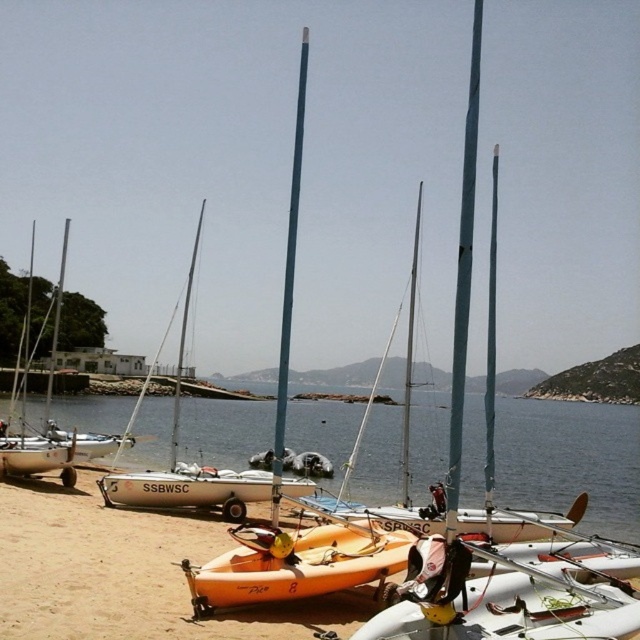
Question: Which point is closer to the camera taking this photo?

Choices:
 (A) (272, 509)
 (B) (248, 576)
 (C) (477, 493)
 (D) (120, 497)

Answer: (B)

Question: Is blue matte mast at center positioned behind white matte mast at left?

Choices:
 (A) no
 (B) yes

Answer: (A)

Question: From the image, what is the correct spatial relationship of clear blue water at center in relation to white matte sailboat at center?

Choices:
 (A) right
 (B) left

Answer: (A)

Question: Which of the following is the farthest from the observer?

Choices:
 (A) (291, 440)
 (B) (289, 292)
 (C) (202, 580)

Answer: (A)

Question: Considering the relative positions of clear blue water at center and white matte boat at center in the image provided, where is clear blue water at center located with respect to white matte boat at center?

Choices:
 (A) left
 (B) right

Answer: (B)

Question: Which object is the farthest from the white matte sailboat at center?

Choices:
 (A) blue matte mast at center
 (B) clear blue water at center
 (C) white matte boat at center
 (D) white matte mast at left

Answer: (B)